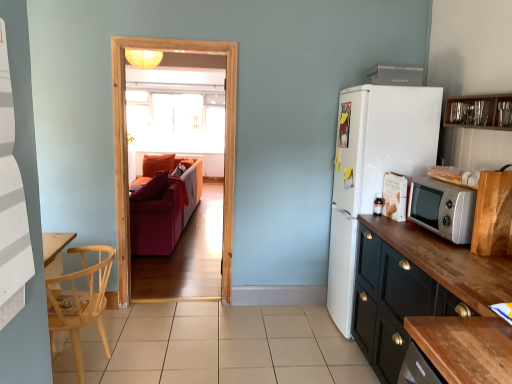
In order to click on vacant region in front of transparent glass door at center in this screenshot , I will do `click(176, 322)`.